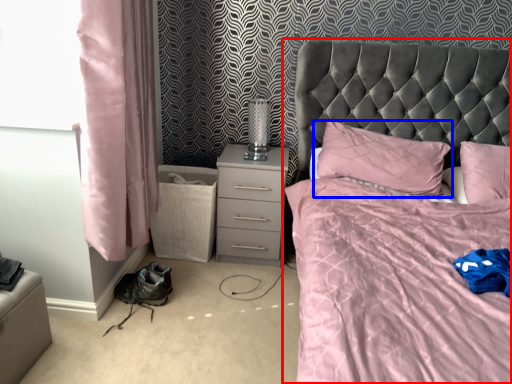
Question: Which object is closer to the camera taking this photo, bed (highlighted by a red box) or pillow (highlighted by a blue box)?

Choices:
 (A) bed
 (B) pillow

Answer: (A)